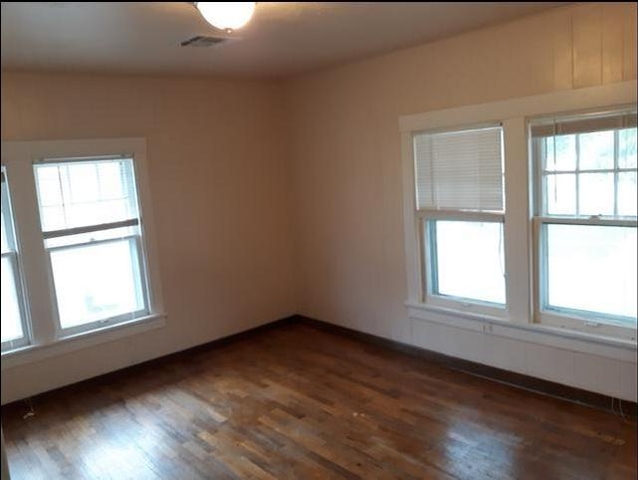
Identify the location of blinds that are all the way up. This screenshot has height=480, width=638. (591, 128).